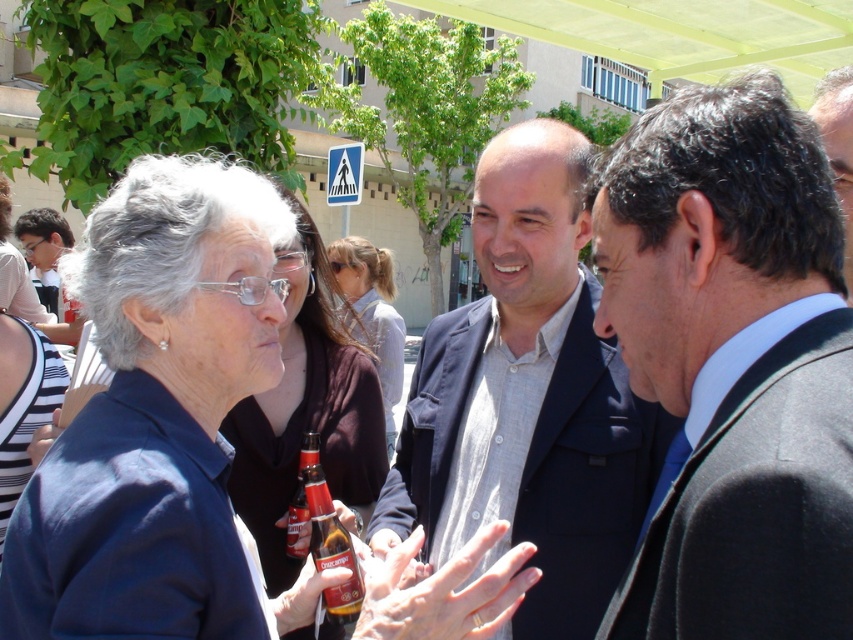
Question: Estimate the real-world distances between objects in this image. Which object is closer to the brown glass bottle at center?

Choices:
 (A) matte blue shirt at center
 (B) dark gray suit at center

Answer: (A)

Question: Based on their relative distances, which object is farther from the dark brown hair at upper right?

Choices:
 (A) light brown hair at center
 (B) dark blue suit at center
 (C) dark gray suit at center

Answer: (A)

Question: Is brown glass bottle at center wider than dark brown hair at upper right?

Choices:
 (A) no
 (B) yes

Answer: (A)

Question: Considering the real-world distances, which object is closest to the light brown hair at center?

Choices:
 (A) dark brown hair at upper right
 (B) dark gray suit at center
 (C) matte black jacket at center

Answer: (C)

Question: From the image, what is the correct spatial relationship of brown glass bottle at center in relation to dark brown hair at upper right?

Choices:
 (A) left
 (B) right

Answer: (A)

Question: Can you confirm if dark blue suit at center is positioned to the right of dark brown hair at upper right?

Choices:
 (A) yes
 (B) no

Answer: (B)